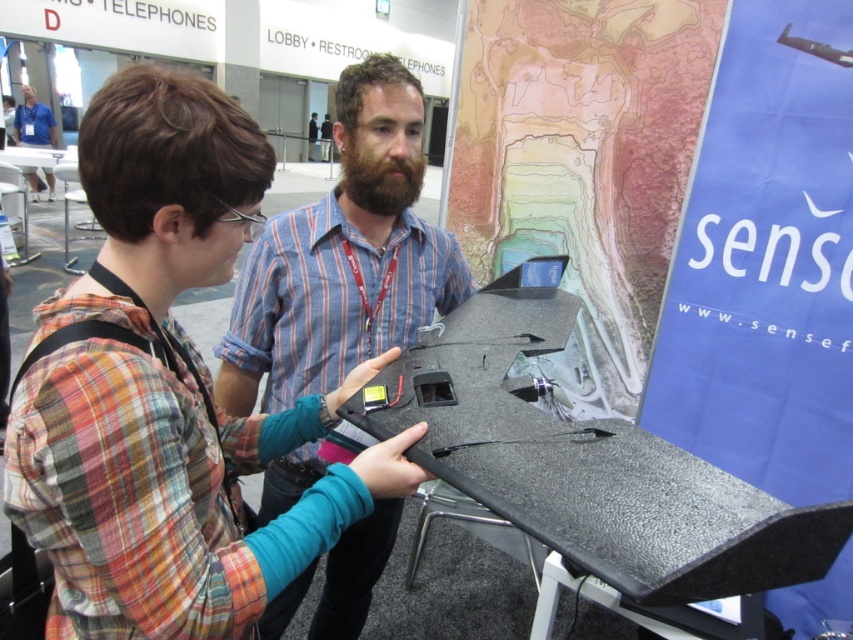
Question: Which object is farther from the camera taking this photo?

Choices:
 (A) matte blue shirt at upper left
 (B) matte blue shirt at center

Answer: (A)

Question: Is matte blue shirt at center to the right of matte blue shirt at upper left from the viewer's perspective?

Choices:
 (A) no
 (B) yes

Answer: (B)

Question: Does matte blue shirt at center have a lesser width compared to matte blue shirt at upper left?

Choices:
 (A) no
 (B) yes

Answer: (B)

Question: Estimate the real-world distances between objects in this image. Which object is closer to the matte blue shirt at upper left?

Choices:
 (A) matte blue shirt at center
 (B) plaid shirt at center

Answer: (A)

Question: Is plaid shirt at center thinner than matte blue shirt at center?

Choices:
 (A) no
 (B) yes

Answer: (B)

Question: Which of the following is the closest to the observer?

Choices:
 (A) matte blue shirt at upper left
 (B) plaid shirt at center
 (C) matte blue shirt at center

Answer: (B)